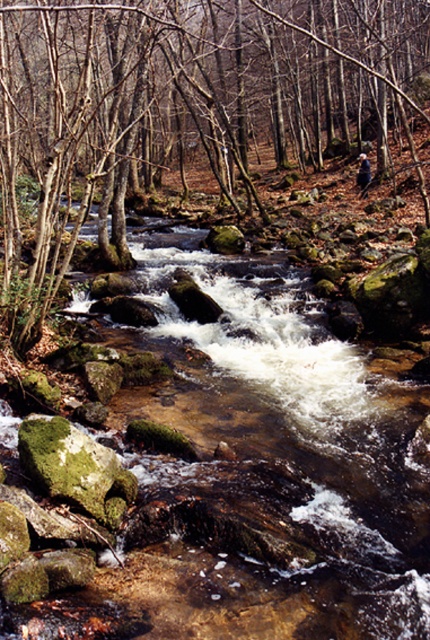
Locate an element on the screen. green mossy rock at center is located at coordinates (183, 106).

The height and width of the screenshot is (640, 430). I want to click on green mossy rock at center, so click(x=183, y=106).

Is clear water at center to the right of green mossy rock at center from the viewer's perspective?

Yes, clear water at center is to the right of green mossy rock at center.

Find the location of a particular element. The width and height of the screenshot is (430, 640). clear water at center is located at coordinates (245, 468).

In the scene shown: Is clear water at center behind green mossy rock at lower left?

No.

Find the location of a particular element. clear water at center is located at coordinates (245, 468).

Does point (365, 381) come in front of point (54, 490)?

No, it is behind (54, 490).

You are a GUI agent. You are given a task and a screenshot of the screen. Output one action in this format:
    pyautogui.click(x=<x>, y=<y>)
    Task: Click on the clear water at center
    The image size is (430, 640).
    Given the screenshot: What is the action you would take?
    pyautogui.click(x=245, y=468)